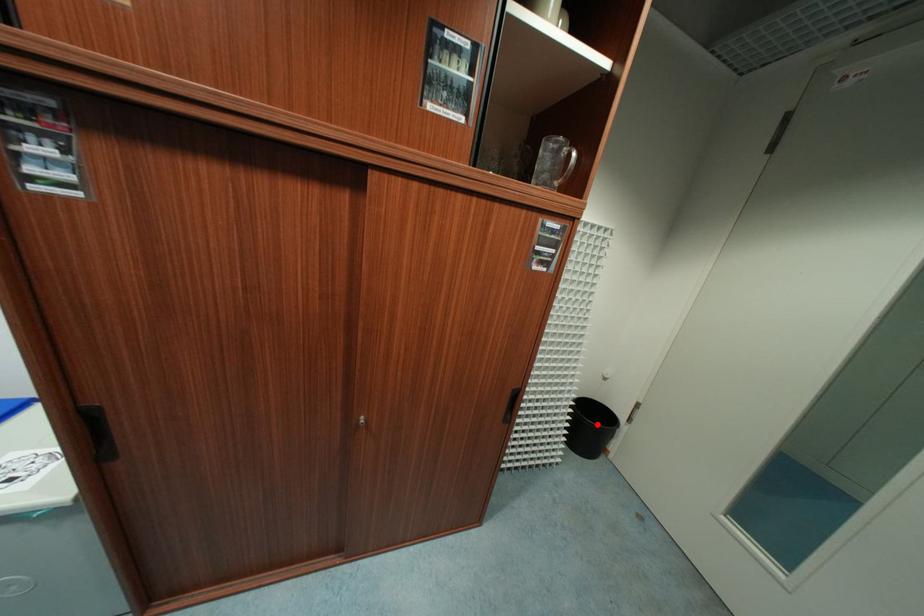
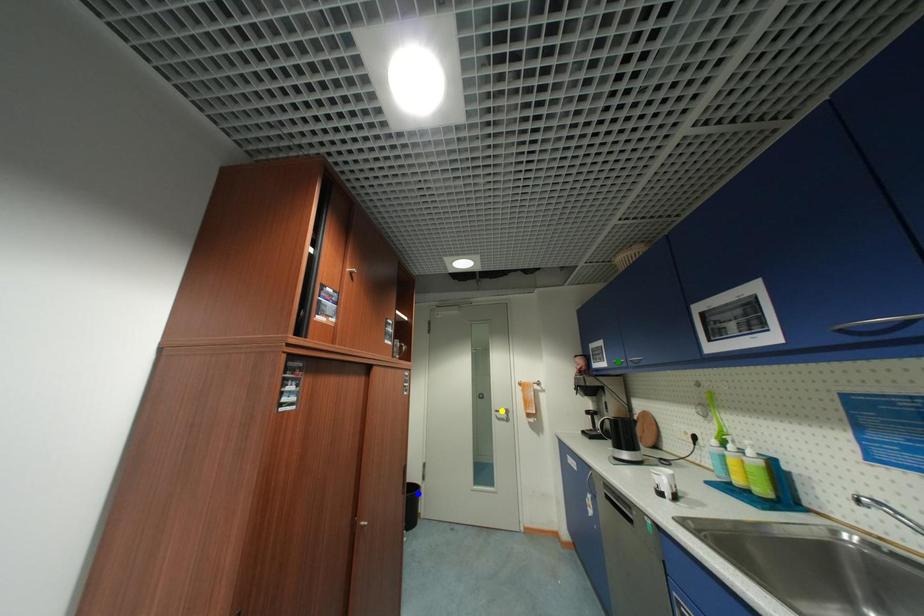
Question: I am providing you with two images of the same scene from different viewpoints. A red point is marked on the first image. You are given multiple points on the second image. Which spot in image 2 lines up with the point in image 1?

Choices:
 (A) green point
 (B) yellow point
 (C) blue point

Answer: (C)